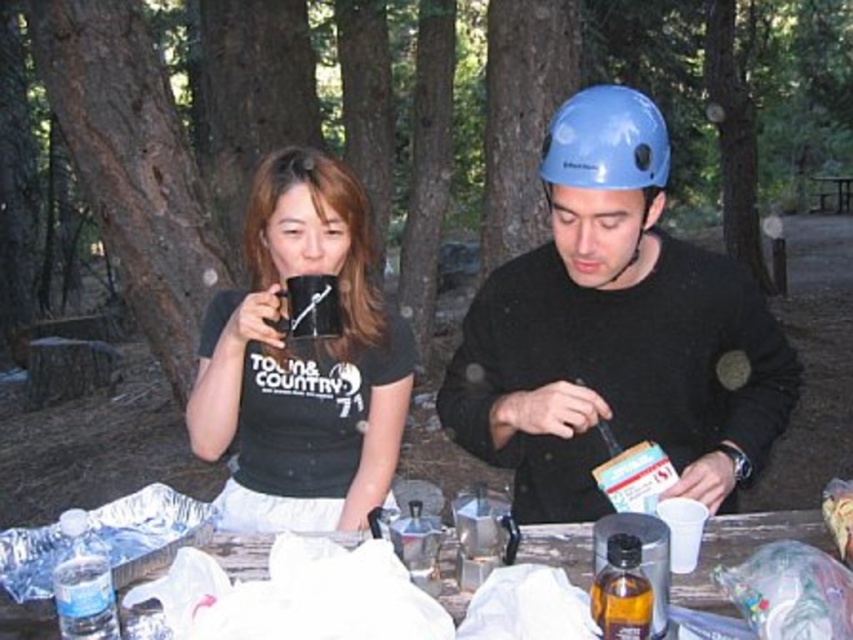
Question: Can you confirm if matte black mug at center is positioned to the right of white plastic bag at lower center?

Choices:
 (A) no
 (B) yes

Answer: (A)

Question: Estimate the real-world distances between objects in this image. Which object is farther from the blue hard hat at center?

Choices:
 (A) wooden picnic table at center
 (B) white plastic bag at lower center

Answer: (A)

Question: Estimate the real-world distances between objects in this image. Which object is closer to the white plastic bag at lower center?

Choices:
 (A) wooden picnic table at center
 (B) blue matte helmet at upper right
 (C) matte black mug at center

Answer: (B)

Question: Which of the following is the farthest from the observer?

Choices:
 (A) (82, 605)
 (B) (604, 625)
 (C) (820, 195)
 (D) (352, 412)

Answer: (C)

Question: Is translucent amber liquid at center positioned behind clear plastic water bottle at lower left?

Choices:
 (A) yes
 (B) no

Answer: (B)

Question: Does blue hard hat at center have a greater width compared to translucent amber liquid at center?

Choices:
 (A) no
 (B) yes

Answer: (B)